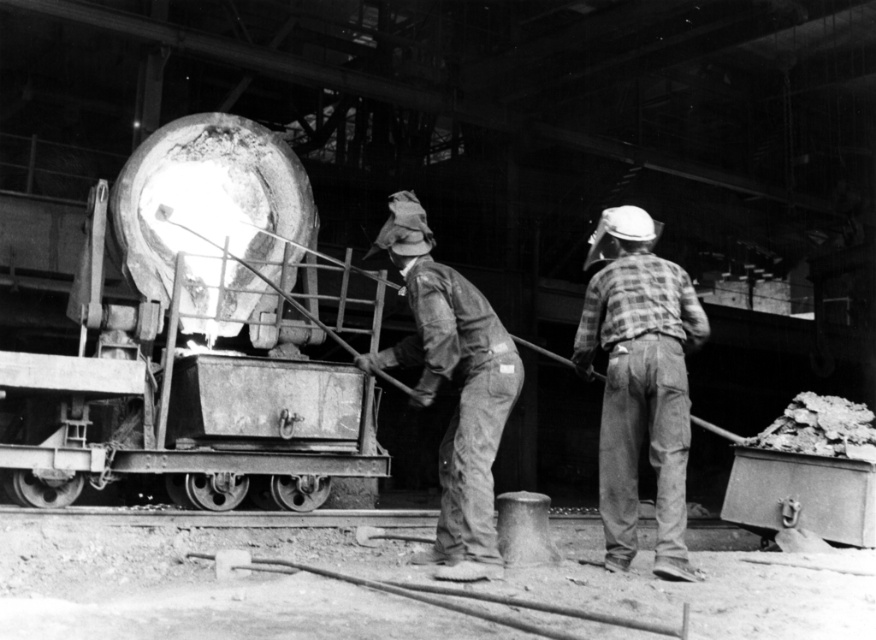
What do you see at coordinates (640, 384) in the screenshot? This screenshot has height=640, width=876. I see `plaid fabric shirt at right` at bounding box center [640, 384].

Between plaid fabric shirt at right and rusty metal shovel at center, which one has less height?

plaid fabric shirt at right

Locate an element on the screen. The image size is (876, 640). plaid fabric shirt at right is located at coordinates (640, 384).